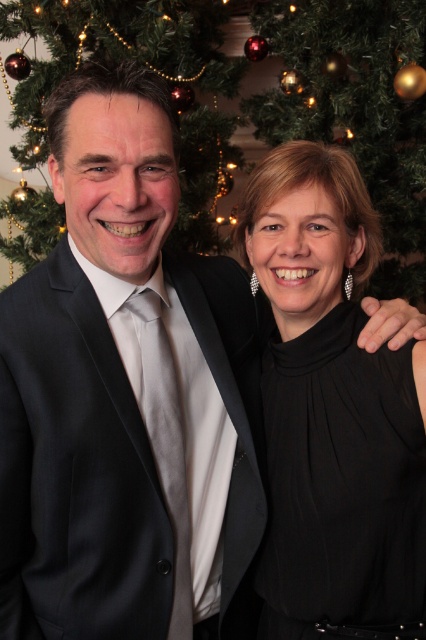
You are planning to take a photo of the scene with the black satin dress at right. To ensure the dress is in focus, where should you aim the camera? Specify the coordinates provided in the description.

A: The black satin dress at right is located at point (342, 486), so aim the camera at those coordinates to ensure the dress is in focus.

You are a photographer at a Christmas party and need to adjust the lighting to ensure both the dark gray suit at center and the black satin dress at right are equally visible. Considering their heights, which one might require more upward lighting to highlight its details?

The dark gray suit at center is taller than the black satin dress at right, so it might require more upward lighting to highlight its details.